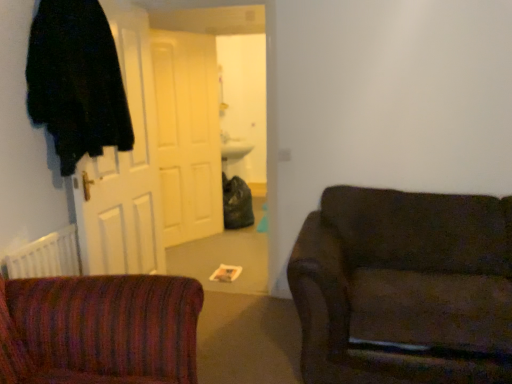
Locate an element on the screen. This screenshot has height=384, width=512. blank space situated above white matte door at center, which is the 2th door from front to back (from a real-world perspective) is located at coordinates (181, 21).